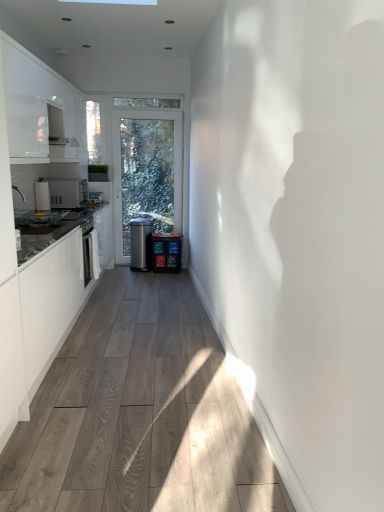
Question: Considering the positions of white glossy countertop at left and matte plastic water cooler at center, the second water cooler in the left-to-right sequence, in the image, is white glossy countertop at left wider or thinner than matte plastic water cooler at center, the second water cooler in the left-to-right sequence,?

Choices:
 (A) thin
 (B) wide

Answer: (B)

Question: In terms of height, does white glossy countertop at left look taller or shorter compared to matte plastic water cooler at center, which is the first water cooler in right-to-left order?

Choices:
 (A) tall
 (B) short

Answer: (A)

Question: Based on their relative distances, which object is farther from the wooden floor at center?

Choices:
 (A) matte plastic water cooler at center, the second water cooler in the left-to-right sequence
 (B) white glossy cabinet at upper left
 (C) satin silver water cooler at center, positioned as the 2th water cooler in right-to-left order
 (D) clear glass window screen at upper left
 (E) white glossy countertop at left

Answer: (D)

Question: Which object is the farthest from the satin silver water cooler at center, positioned as the 2th water cooler in right-to-left order?

Choices:
 (A) clear glass window screen at upper left
 (B) wooden floor at center
 (C) matte plastic water cooler at center, which is the first water cooler in right-to-left order
 (D) white glossy cabinet at upper left
 (E) satin silver microwave at left

Answer: (B)